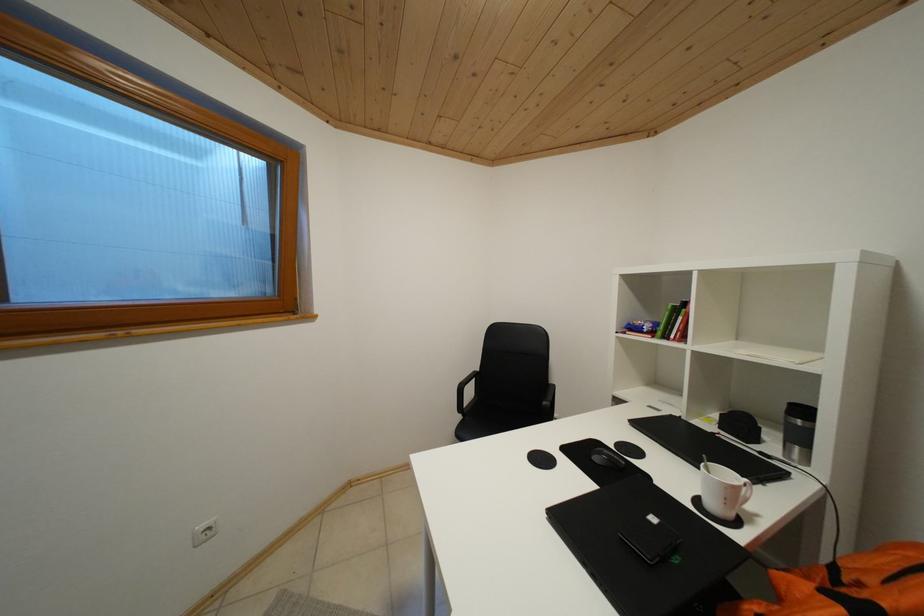
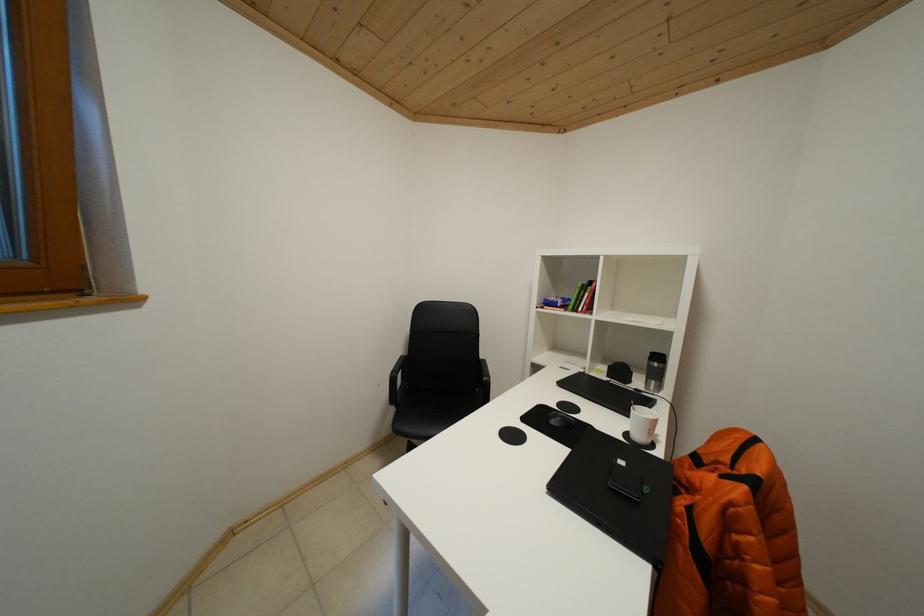
Question: Based on the continuous images, in which direction is the camera rotating? Reply with the corresponding letter.

Choices:
 (A) Left
 (B) Right
 (C) Up
 (D) Down

Answer: (B)